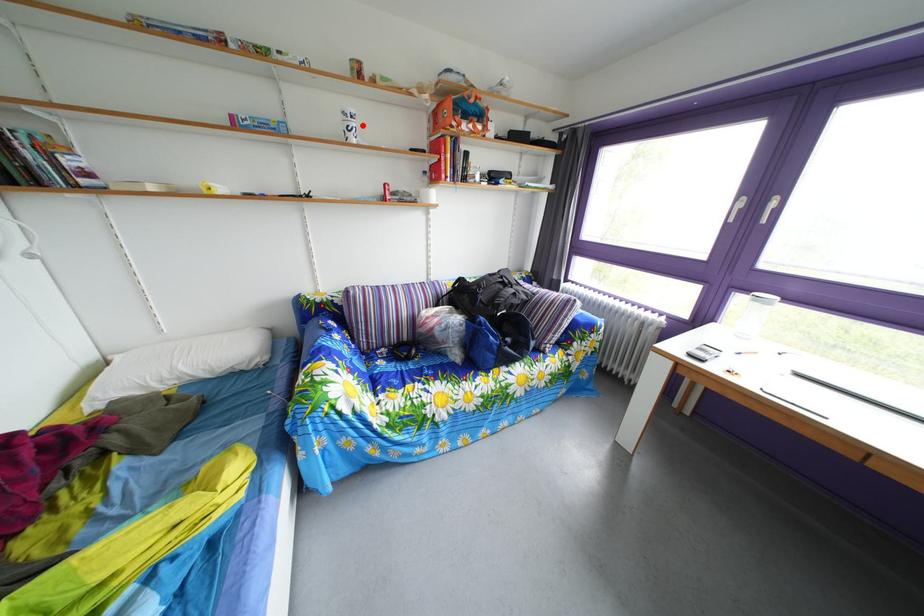
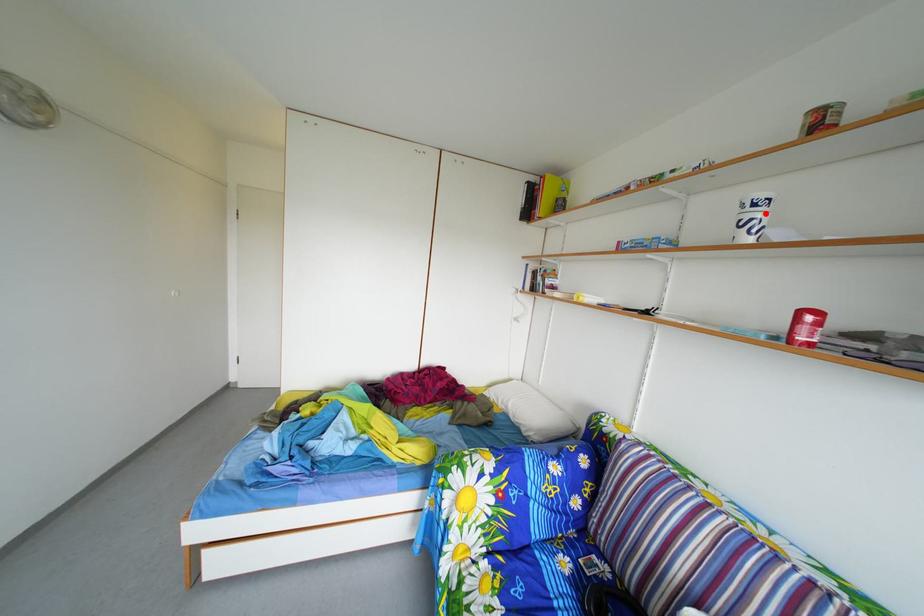
I am providing you with two images of the same scene from different viewpoints. A red point is marked on the first image and another point is marked on the second image. Is the red point in image1 aligned with the point shown in image2?

Yes